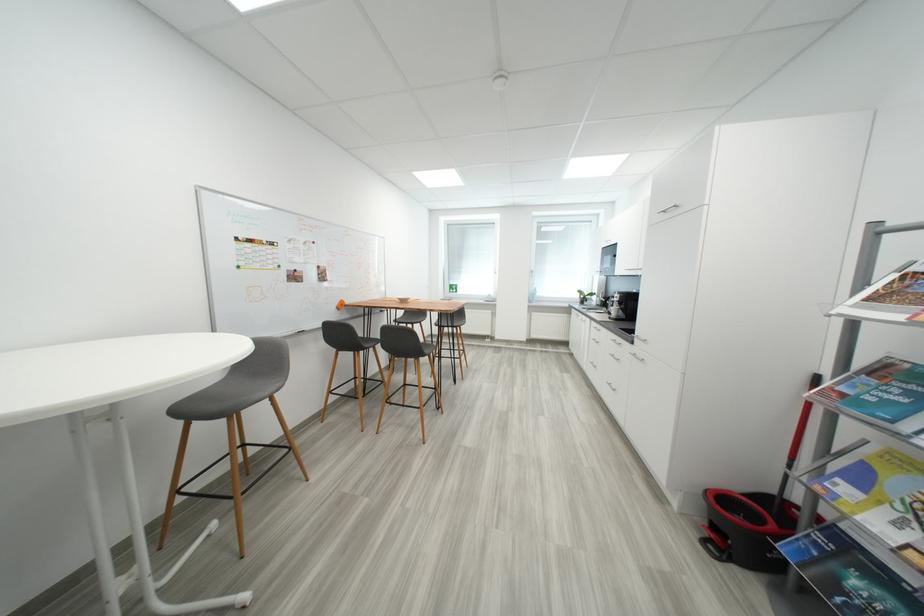
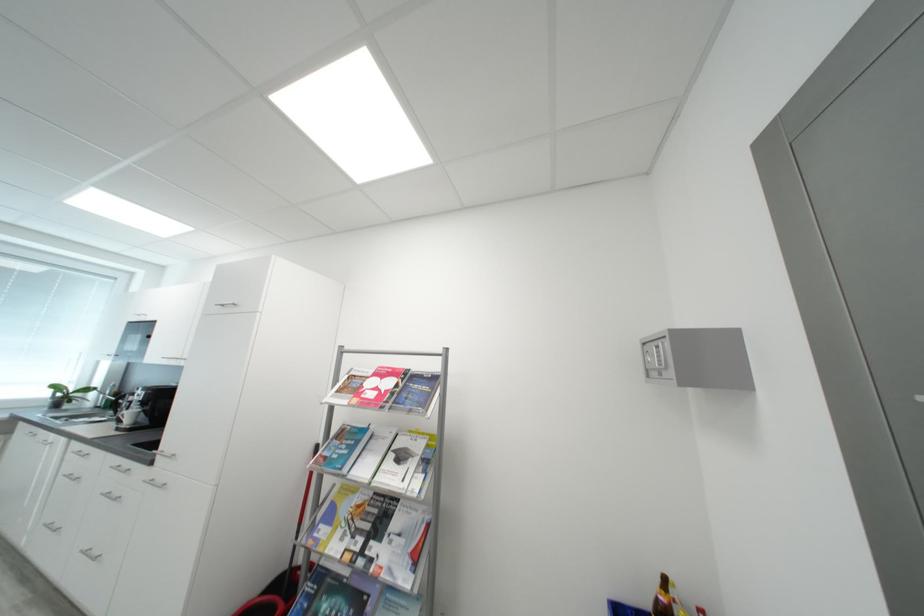
Find the pixel in the second image that matches [604,299] in the first image.

(108, 394)